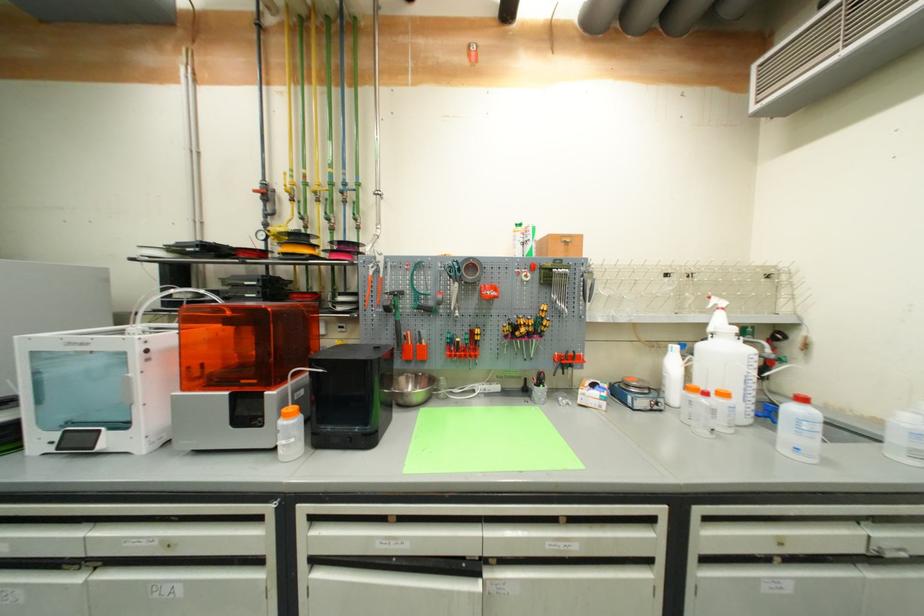
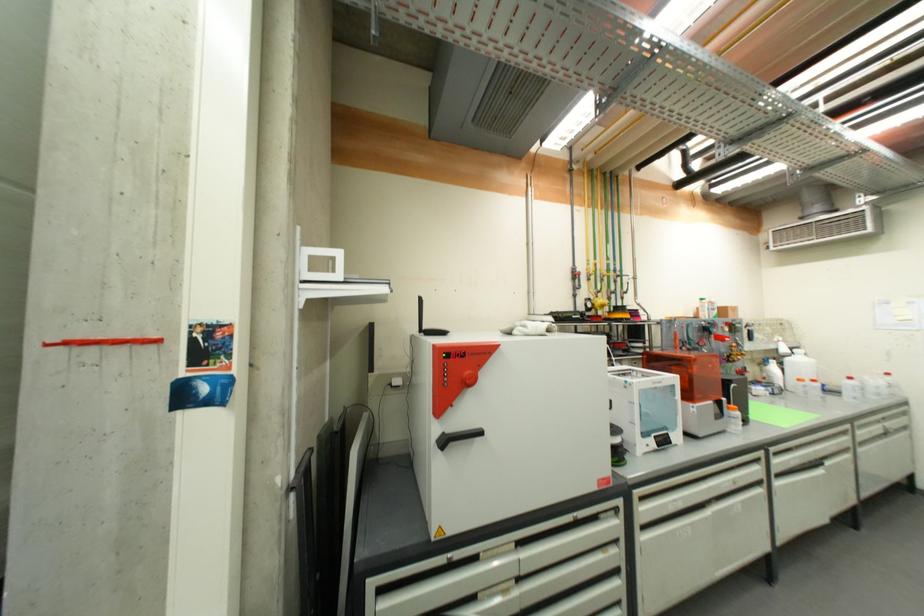
Where in the second image is the point corresponding to [294,418] from the first image?

(739, 411)